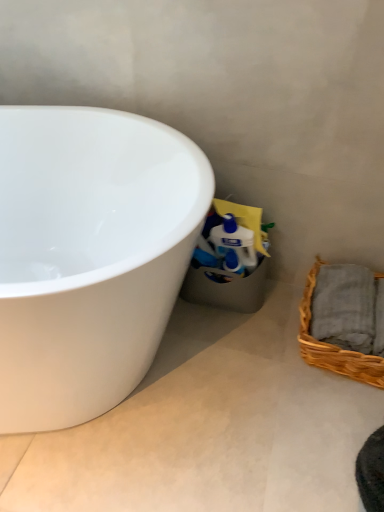
Question: From a real-world perspective, is woven brown picnic basket at lower right located beneath white glossy bathtub at left?

Choices:
 (A) yes
 (B) no

Answer: (A)

Question: From a real-world perspective, is woven brown picnic basket at lower right positioned over white glossy bathtub at left based on gravity?

Choices:
 (A) yes
 (B) no

Answer: (B)

Question: From the image's perspective, is woven brown picnic basket at lower right located above white glossy bathtub at left?

Choices:
 (A) yes
 (B) no

Answer: (B)

Question: Is the depth of woven brown picnic basket at lower right less than that of white glossy bathtub at left?

Choices:
 (A) yes
 (B) no

Answer: (B)

Question: From the image's perspective, is woven brown picnic basket at lower right below white glossy bathtub at left?

Choices:
 (A) yes
 (B) no

Answer: (A)

Question: From the image's perspective, is white glossy concrete at lower left located above or below woven brown picnic basket at lower right?

Choices:
 (A) above
 (B) below

Answer: (B)

Question: Is white glossy concrete at lower left inside or outside of woven brown picnic basket at lower right?

Choices:
 (A) outside
 (B) inside

Answer: (A)

Question: From a real-world perspective, relative to woven brown picnic basket at lower right, is white glossy concrete at lower left vertically above or below?

Choices:
 (A) below
 (B) above

Answer: (A)

Question: Is point 208,471 closer or farther from the camera than point 334,359?

Choices:
 (A) closer
 (B) farther

Answer: (A)

Question: Considering the positions of white glossy bathtub at left and white glossy concrete at lower left in the image, is white glossy bathtub at left wider or thinner than white glossy concrete at lower left?

Choices:
 (A) wide
 (B) thin

Answer: (B)

Question: In the image, is white glossy bathtub at left positioned in front of or behind white glossy concrete at lower left?

Choices:
 (A) front
 (B) behind

Answer: (A)

Question: Is white glossy bathtub at left situated inside white glossy concrete at lower left or outside?

Choices:
 (A) inside
 (B) outside

Answer: (B)

Question: Is point tap(13, 376) closer or farther from the camera than point tap(44, 481)?

Choices:
 (A) farther
 (B) closer

Answer: (B)

Question: From the image's perspective, relative to white glossy bathtub at left, is white glossy concrete at lower left above or below?

Choices:
 (A) below
 (B) above

Answer: (A)

Question: Is point (322, 453) positioned closer to the camera than point (117, 306)?

Choices:
 (A) closer
 (B) farther

Answer: (B)